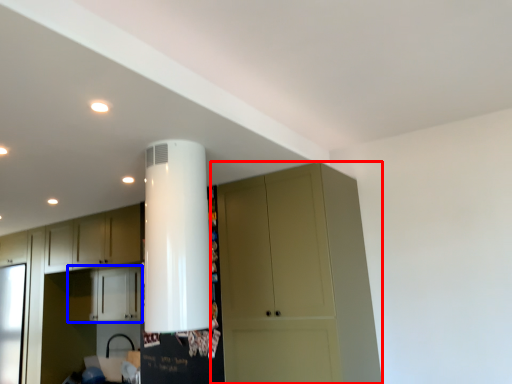
Question: Which of the following is the closest to the observer, cupboard (highlighted by a red box) or cabinetry (highlighted by a blue box)?

Choices:
 (A) cupboard
 (B) cabinetry

Answer: (A)